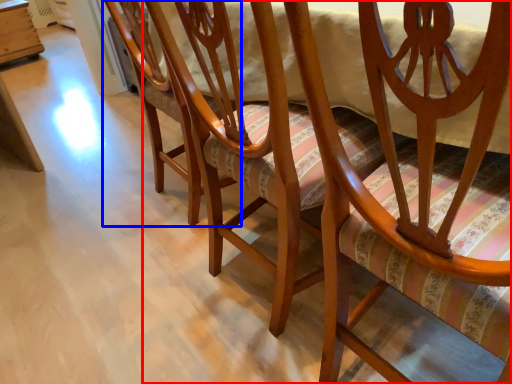
Question: Among these objects, which one is nearest to the camera, chair (highlighted by a red box) or chair (highlighted by a blue box)?

Choices:
 (A) chair
 (B) chair

Answer: (A)